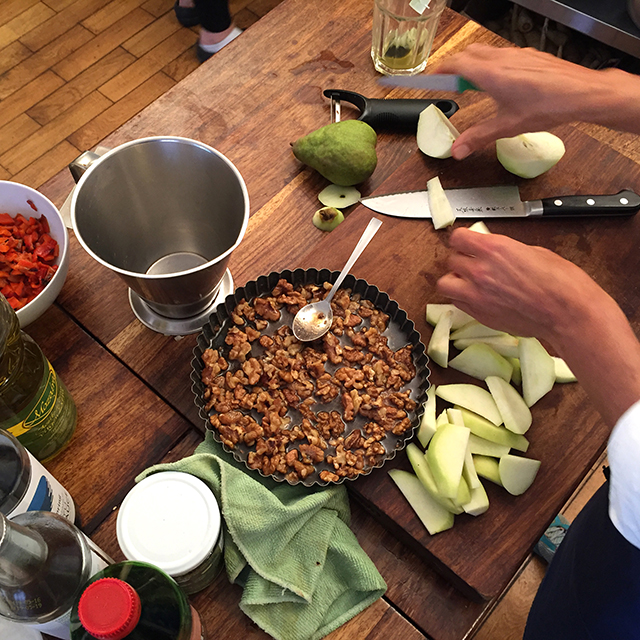
I want to click on surfaces, so click(255, 157), click(379, 257).